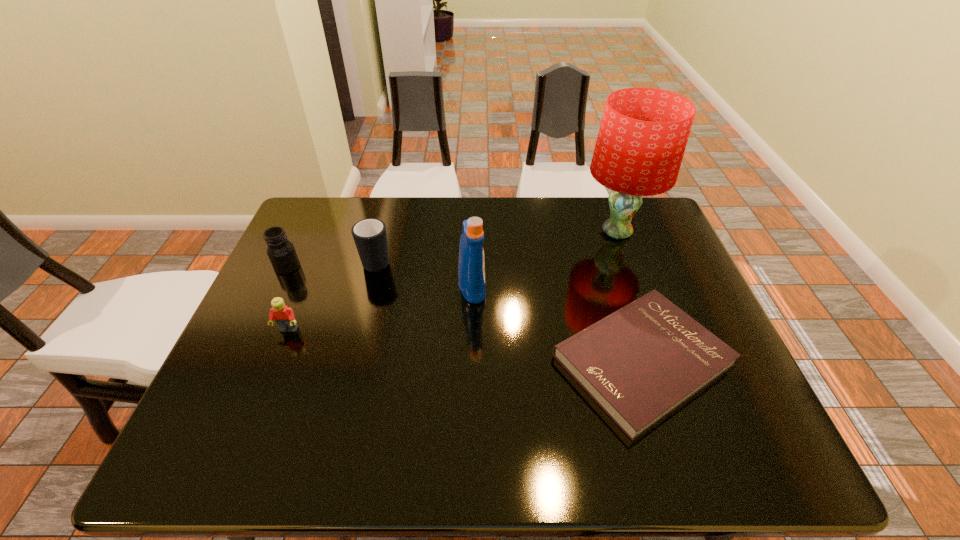
In order to click on lampshade in this screenshot , I will do `click(643, 134)`.

The width and height of the screenshot is (960, 540). What are the coordinates of `the fourth object from left to right` in the screenshot? It's located at (471, 267).

Locate an element on the screen. This screenshot has height=540, width=960. the second tallest object is located at coordinates (471, 267).

I want to click on the fourth object from right to left, so coord(370,237).

The height and width of the screenshot is (540, 960). Find the location of `the leftmost object`. the leftmost object is located at coordinates (281, 252).

Identify the location of the second shortest object. (284, 316).

This screenshot has height=540, width=960. Identify the location of the fifth object from right to left. (284, 316).

Where is `the shortest object`? The width and height of the screenshot is (960, 540). the shortest object is located at coordinates (640, 363).

The height and width of the screenshot is (540, 960). In order to click on blank area located 0.310m on the front-facing side of the lampshade in this screenshot , I will do `click(478, 232)`.

Locate an element on the screen. This screenshot has width=960, height=540. free location located on the front-facing side of the lampshade is located at coordinates (516, 232).